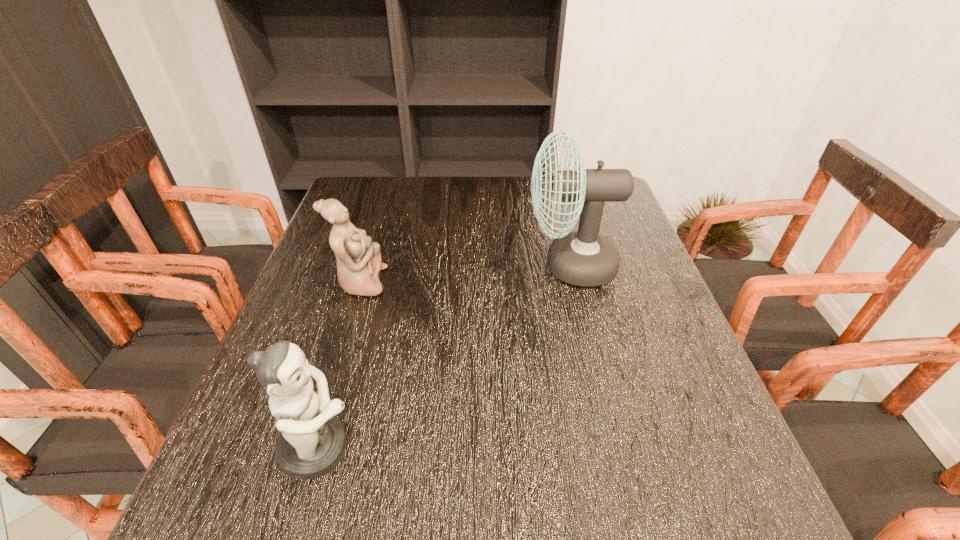
This screenshot has height=540, width=960. Find the location of `vacant space at the far edge`. vacant space at the far edge is located at coordinates (468, 180).

The height and width of the screenshot is (540, 960). I want to click on blank area at the near edge, so click(377, 502).

At what (x,y) coordinates should I click in order to perform the action: click on free spot at the left edge of the desktop. Please return your answer as a coordinate pair (x, y). This screenshot has height=540, width=960. Looking at the image, I should click on (333, 336).

This screenshot has width=960, height=540. In the image, there is a desktop. In order to click on vacant space at the right edge in this screenshot , I will do `click(734, 442)`.

Where is `free space at the far left corner`? This screenshot has height=540, width=960. free space at the far left corner is located at coordinates (396, 180).

In the image, there is a desktop. Identify the location of vacant space at the near left corner. (273, 525).

Find the location of a particular element. free spot at the near right corner of the desktop is located at coordinates (699, 535).

Locate an element on the screen. vacant area that lies between the farther figurine and the tallest object is located at coordinates (466, 274).

Locate an element on the screen. free space between the nearer figurine and the farther figurine is located at coordinates (340, 365).

Locate an element on the screen. The width and height of the screenshot is (960, 540). free spot between the fan and the farther figurine is located at coordinates (466, 274).